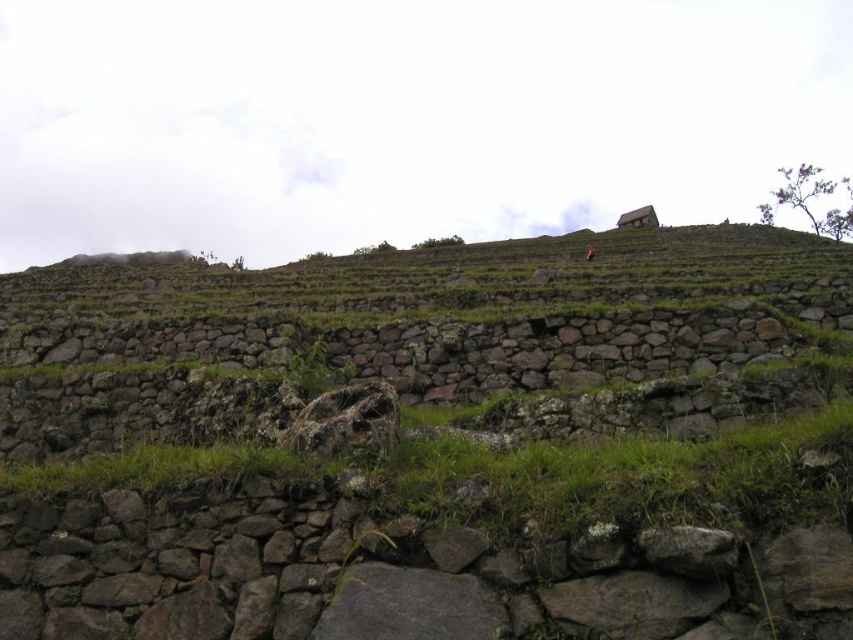
Which of these two, natural stone terraces at upper center or brown stone figure at upper center, stands shorter?

brown stone figure at upper center

Between point (726, 548) and point (589, 253), which one is positioned behind?

The point (589, 253) is behind.

Find the location of a particular element. The height and width of the screenshot is (640, 853). natural stone terraces at upper center is located at coordinates (442, 452).

Is point (572, 280) positioned after point (654, 221)?

No.

Which is in front, point (97, 525) or point (656, 218)?

Point (97, 525) is in front.

Does point (279, 556) come farther from viewer compared to point (654, 220)?

No, it is not.

The height and width of the screenshot is (640, 853). Find the location of `natural stone terraces at upper center`. natural stone terraces at upper center is located at coordinates (442, 452).

In the scene shown: Who is positioned more to the right, brown wooden hut at upper center or brown stone figure at upper center?

From the viewer's perspective, brown wooden hut at upper center appears more on the right side.

Is brown wooden hut at upper center to the left of brown stone figure at upper center from the viewer's perspective?

Incorrect, brown wooden hut at upper center is not on the left side of brown stone figure at upper center.

This screenshot has height=640, width=853. Describe the element at coordinates (637, 218) in the screenshot. I see `brown wooden hut at upper center` at that location.

Find the location of `brown wooden hut at upper center`. brown wooden hut at upper center is located at coordinates point(637,218).